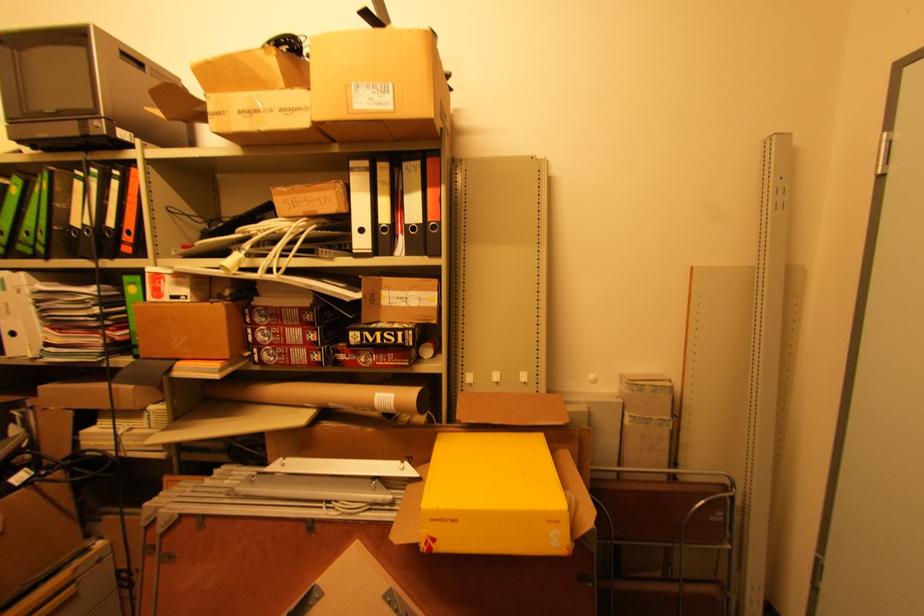
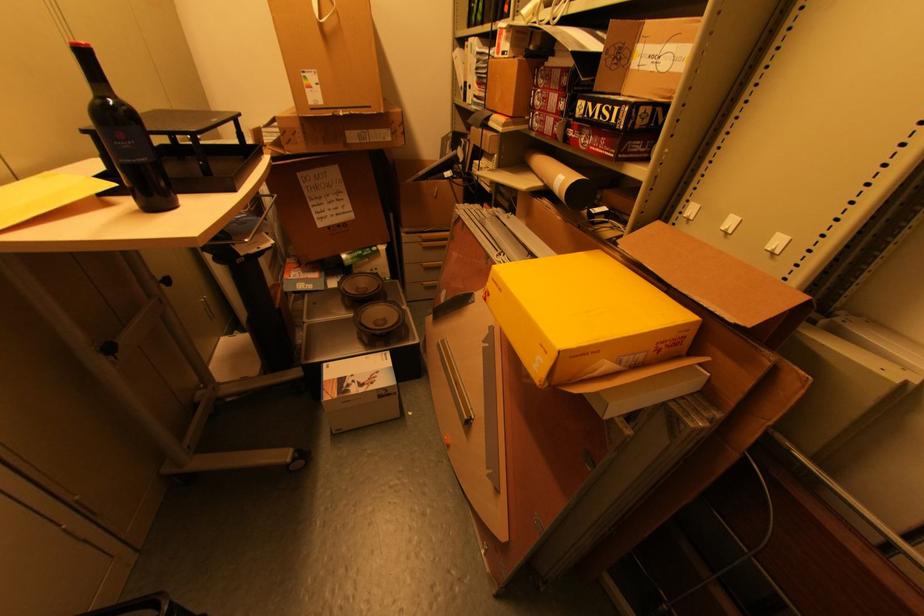
Locate, in the second image, the point that corresponds to [444,521] in the first image.

(499, 284)